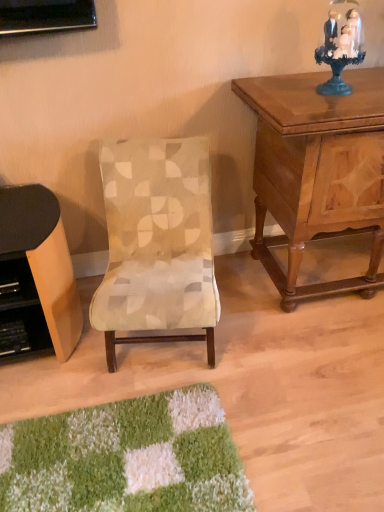
This screenshot has height=512, width=384. What are the coordinates of `free space in front of wooden nightstand at upper right` in the screenshot? It's located at (310, 379).